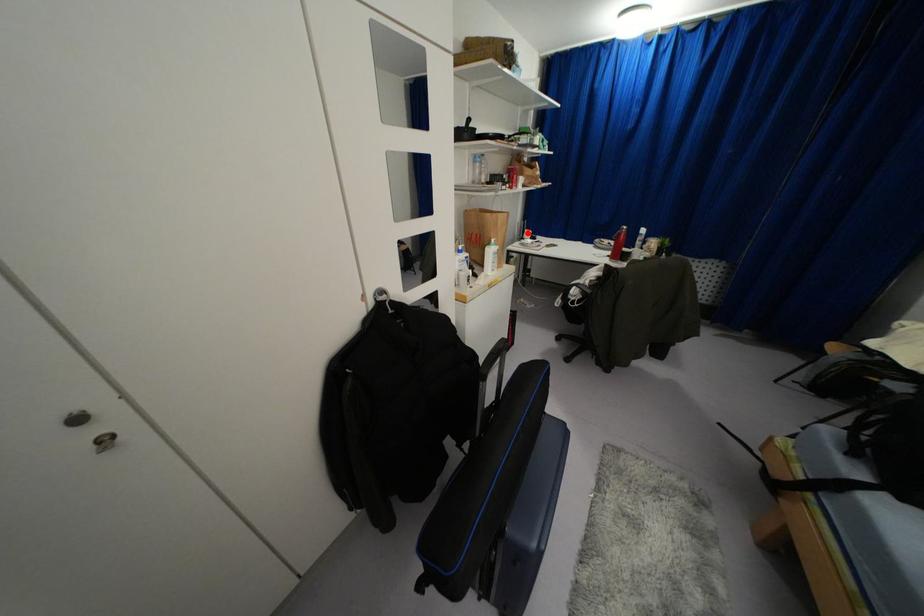
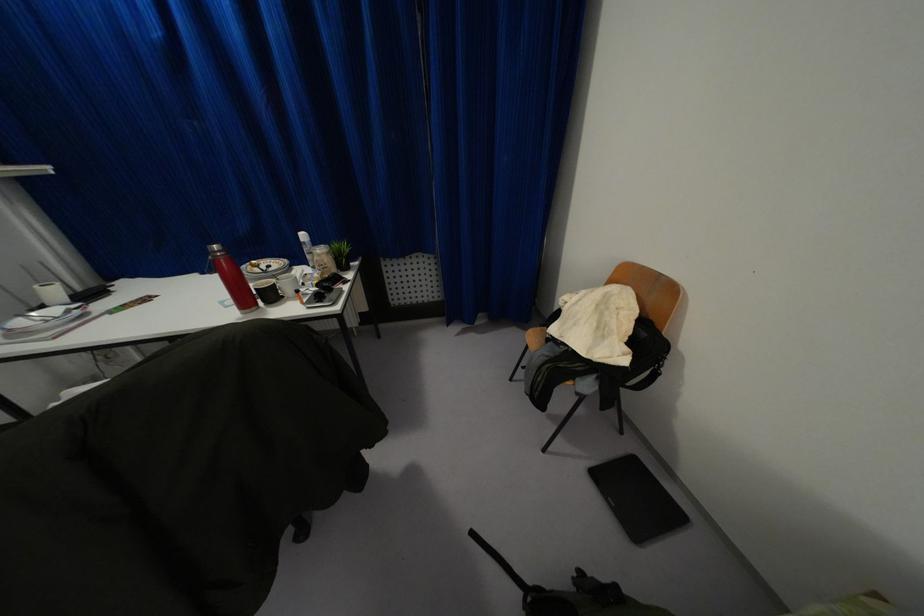
In the second image, find the point that corresponds to the highlighted location in the first image.

(53, 291)